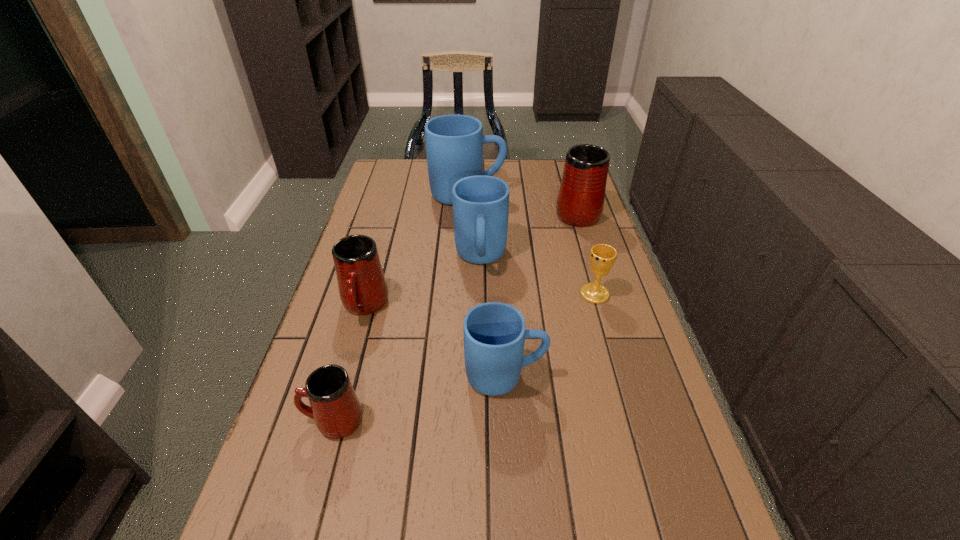
Where is `free space that satisfies the following two spatial constraints: 1. on the side of the second biggest blue mug with the handle; 2. on the right side of the gold chalice`? free space that satisfies the following two spatial constraints: 1. on the side of the second biggest blue mug with the handle; 2. on the right side of the gold chalice is located at coordinates (481, 294).